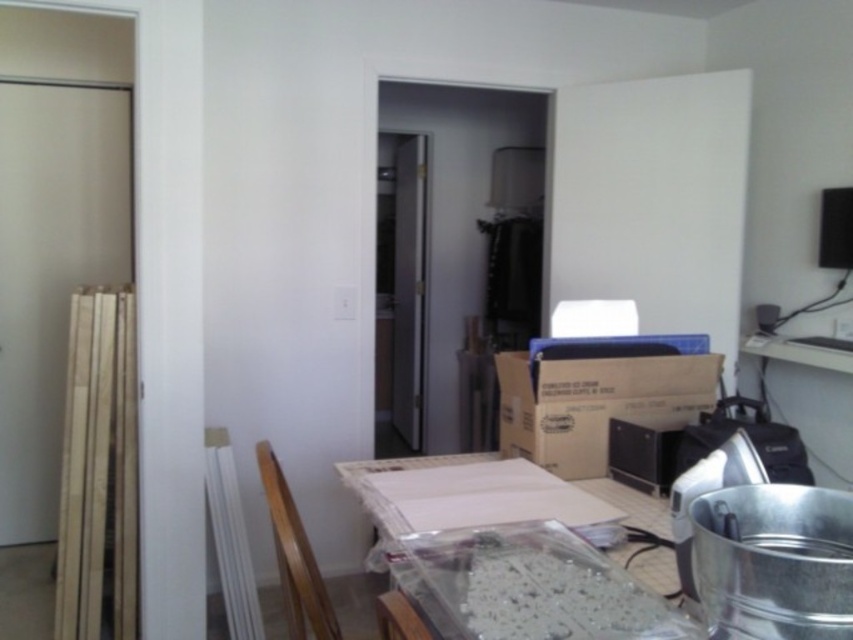
Is clear plastic table at center smaller than wooden chair at lower center?

Actually, clear plastic table at center might be larger than wooden chair at lower center.

Which of these two, clear plastic table at center or wooden chair at lower center, stands taller?

wooden chair at lower center

What do you see at coordinates (511, 556) in the screenshot? I see `clear plastic table at center` at bounding box center [511, 556].

This screenshot has height=640, width=853. What are the coordinates of `clear plastic table at center` in the screenshot? It's located at (511, 556).

Does clear plastic table at center come behind brown cardboard box at center?

No, it is in front of brown cardboard box at center.

Which is behind, point (463, 563) or point (567, 429)?

The point (567, 429) is more distant.

What are the coordinates of `clear plastic table at center` in the screenshot? It's located at (x=511, y=556).

Is point (531, 376) closer to viewer compared to point (331, 612)?

No.

The height and width of the screenshot is (640, 853). What are the coordinates of `brown cardboard box at center` in the screenshot? It's located at (595, 403).